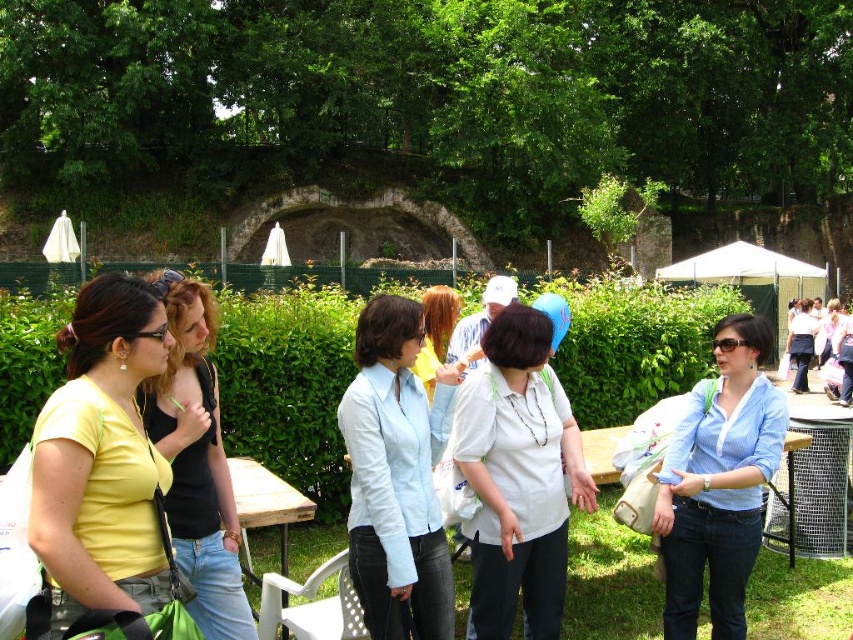
Question: Which of these objects is positioned farthest from the light brown hair at center?

Choices:
 (A) blue striped shirt at center
 (B) white matte shirt at center
 (C) light blue shirt at center
 (D) white cotton shirt at center

Answer: (D)

Question: Considering the relative positions of white fabric umbrella at upper center and matte yellow shirt at left in the image provided, where is white fabric umbrella at upper center located with respect to matte yellow shirt at left?

Choices:
 (A) left
 (B) right

Answer: (B)

Question: Which object is positioned closest to the white matte shirt at center?

Choices:
 (A) blue striped shirt at center
 (B) matte yellow shirt at left

Answer: (A)

Question: Which point is closer to the camera?

Choices:
 (A) matte black top at left
 (B) white fabric umbrella at upper center
 (C) white matte shirt at center

Answer: (B)

Question: Does white fabric umbrella at upper center come behind matte yellow shirt at left?

Choices:
 (A) no
 (B) yes

Answer: (B)

Question: Observing the image, what is the correct spatial positioning of matte yellow shirt at left in reference to white cotton shirt at center?

Choices:
 (A) right
 (B) left

Answer: (B)